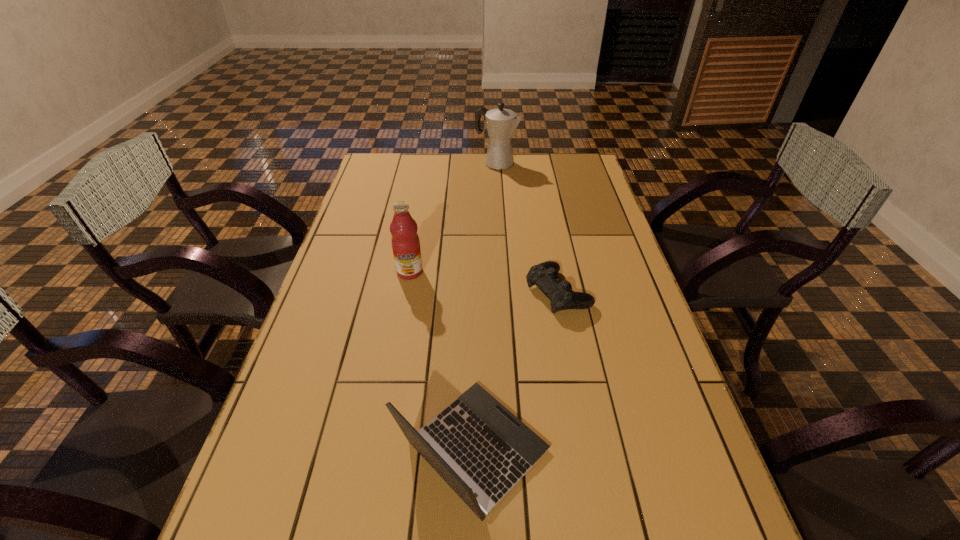
This screenshot has width=960, height=540. Identify the location of object that is at the right edge. (545, 276).

At what (x,y) coordinates should I click in order to perform the action: click on free spot at the far edge of the desktop. Please return your answer as a coordinate pair (x, y). The width and height of the screenshot is (960, 540). Looking at the image, I should click on [517, 181].

At what (x,y) coordinates should I click in order to perform the action: click on vacant space at the left edge. Please return your answer as a coordinate pair (x, y). The image size is (960, 540). Looking at the image, I should click on (385, 250).

This screenshot has height=540, width=960. In order to click on free region at the right edge of the desktop in this screenshot , I will do `click(586, 263)`.

The image size is (960, 540). I want to click on vacant space at the far left corner, so click(369, 166).

At what (x,y) coordinates should I click in order to perform the action: click on free space that is in between the third tallest object and the control. Please return your answer as a coordinate pair (x, y). This screenshot has width=960, height=540. Looking at the image, I should click on (516, 371).

Where is `unoccupied area between the farthest object and the control`? Image resolution: width=960 pixels, height=540 pixels. unoccupied area between the farthest object and the control is located at coordinates (527, 228).

Find the location of `vacant area that lies between the fruit juice and the laptop_computer`. vacant area that lies between the fruit juice and the laptop_computer is located at coordinates (442, 361).

Identify the location of free space between the control and the fruit juice. Image resolution: width=960 pixels, height=540 pixels. [484, 282].

Locate an element on the screen. This screenshot has width=960, height=540. free point between the coffeepot and the third tallest object is located at coordinates click(x=485, y=307).